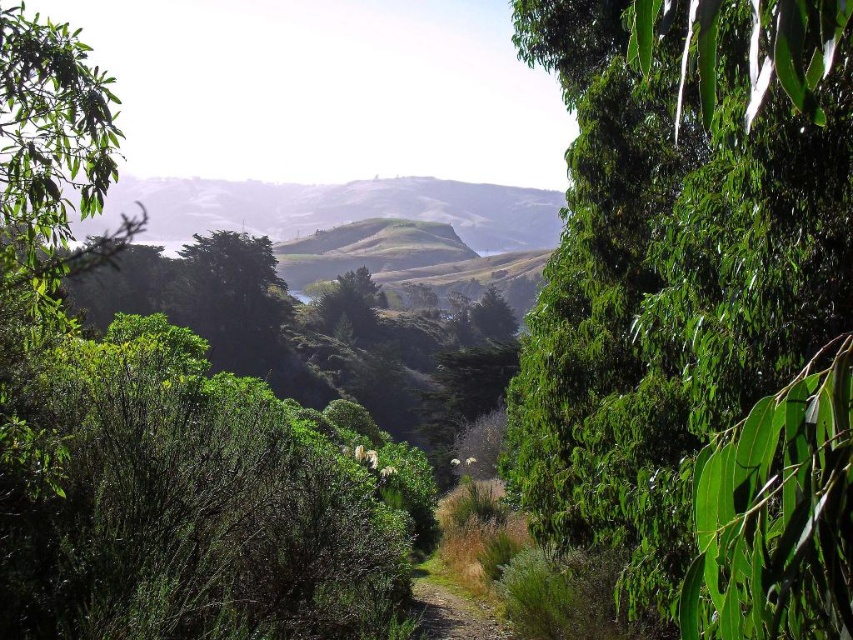
Consider the image. Between green leafy tree at left and gravel path at center, which one is positioned higher?

green leafy tree at left is above.

Is point (68, 44) closer to viewer compared to point (469, 632)?

Yes, point (68, 44) is in front of point (469, 632).

Where is `green leafy tree at left`? green leafy tree at left is located at coordinates (51, 156).

Which is more to the right, green leafy tree at center or gravel path at center?

From the viewer's perspective, green leafy tree at center appears more on the right side.

Who is higher up, green leafy tree at center or gravel path at center?

Positioned higher is green leafy tree at center.

Identify the location of green leafy tree at center. The height and width of the screenshot is (640, 853). pos(666,285).

Can you confirm if green leafy tree at center is positioned to the right of green leafy tree at left?

Indeed, green leafy tree at center is positioned on the right side of green leafy tree at left.

Between green leafy tree at center and green leafy tree at left, which one has more height?

Standing taller between the two is green leafy tree at left.

Is point (561, 474) positioned behind point (96, 193)?

Yes, point (561, 474) is behind point (96, 193).

Find the location of a particular element. Image resolution: width=853 pixels, height=640 pixels. green leafy tree at center is located at coordinates (666, 285).